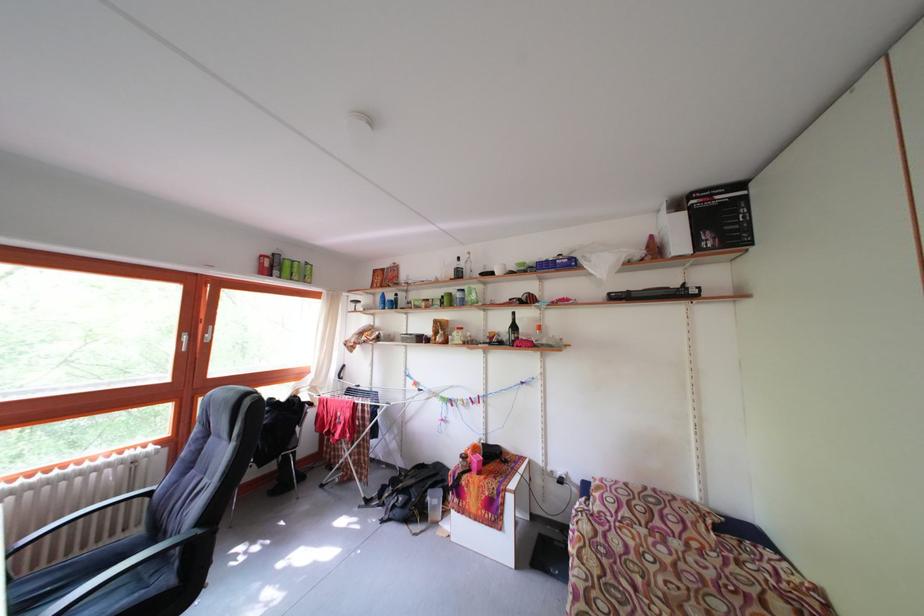
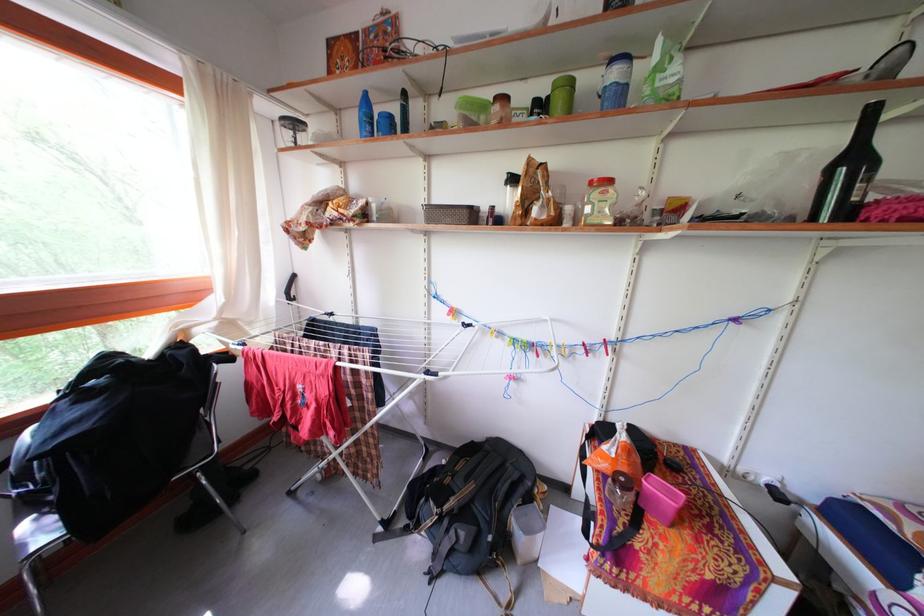
Where in the second image is the point corresponding to point (457, 411) from the first image?

(540, 361)